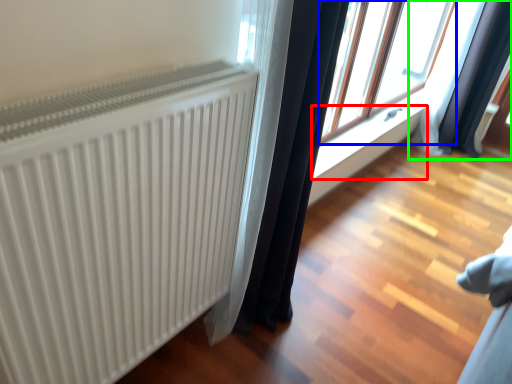
Question: Which object is positioned closest to window sill (highlighted by a red box)? Select from window (highlighted by a blue box) and curtain (highlighted by a green box).

Choices:
 (A) window
 (B) curtain

Answer: (A)